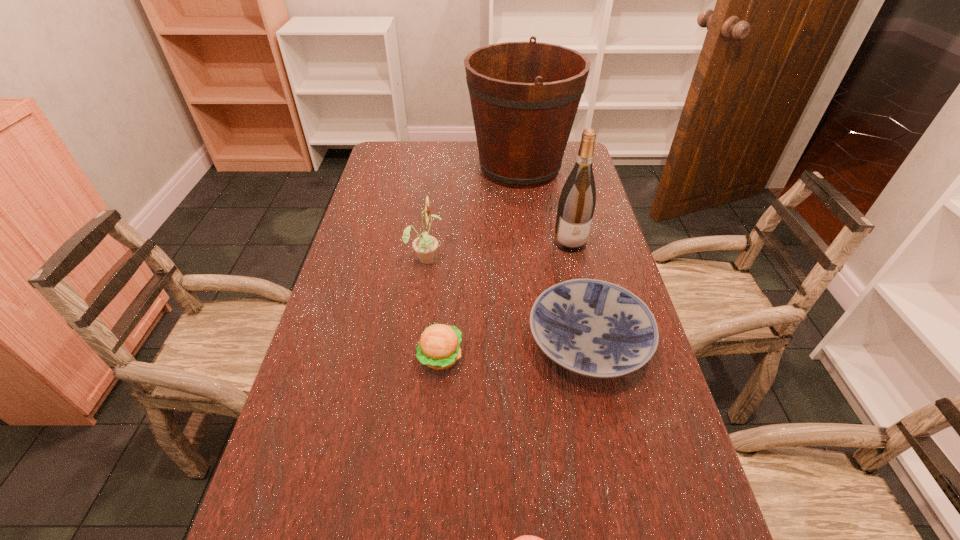
Identify the location of object that is at the far edge. The image size is (960, 540). (524, 96).

This screenshot has height=540, width=960. I want to click on bucket at the right edge, so click(x=524, y=96).

This screenshot has width=960, height=540. Find the location of `wine bottle that is at the right edge`. wine bottle that is at the right edge is located at coordinates (576, 205).

Image resolution: width=960 pixels, height=540 pixels. Find the location of `plate at the right edge`. plate at the right edge is located at coordinates (593, 328).

Locate an element on the screen. The height and width of the screenshot is (540, 960). object that is at the far right corner is located at coordinates (524, 96).

Locate an element on the screen. vacant region at the far edge is located at coordinates (430, 169).

In the image, there is a desktop. Identify the location of vacant space at the left edge. (400, 191).

The image size is (960, 540). What are the coordinates of `vacant space at the right edge of the desktop` in the screenshot? It's located at (562, 186).

Where is `free spot at the far left corner of the desktop`? The image size is (960, 540). free spot at the far left corner of the desktop is located at coordinates [409, 160].

The height and width of the screenshot is (540, 960). Find the location of `free spot between the hamburger and the wine bottle`. free spot between the hamburger and the wine bottle is located at coordinates (505, 299).